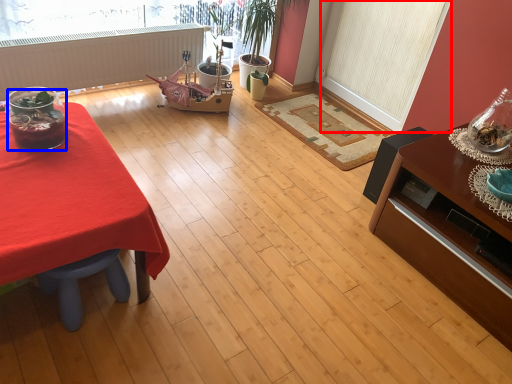
Question: Among these objects, which one is nearest to the camera, screen door (highlighted by a red box) or food (highlighted by a blue box)?

Choices:
 (A) screen door
 (B) food

Answer: (B)